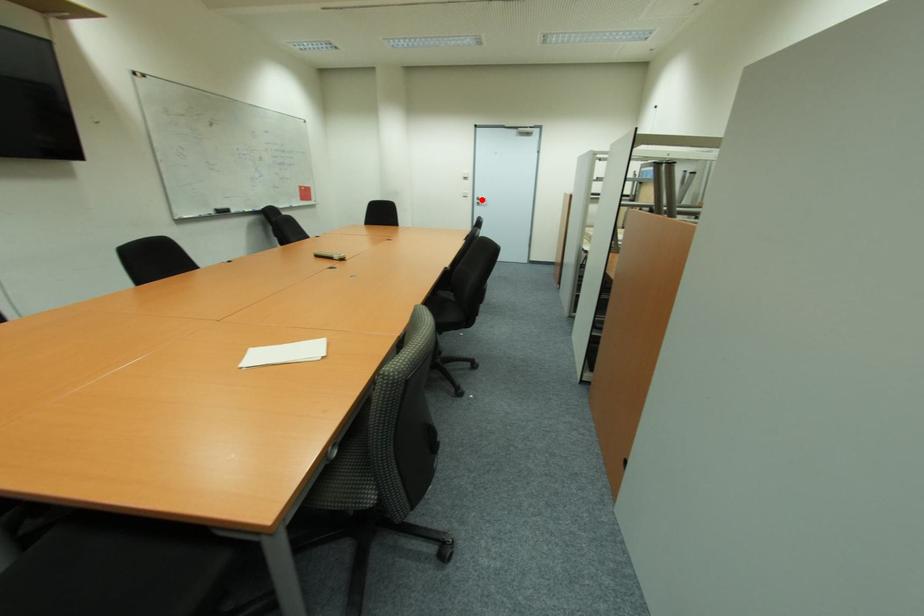
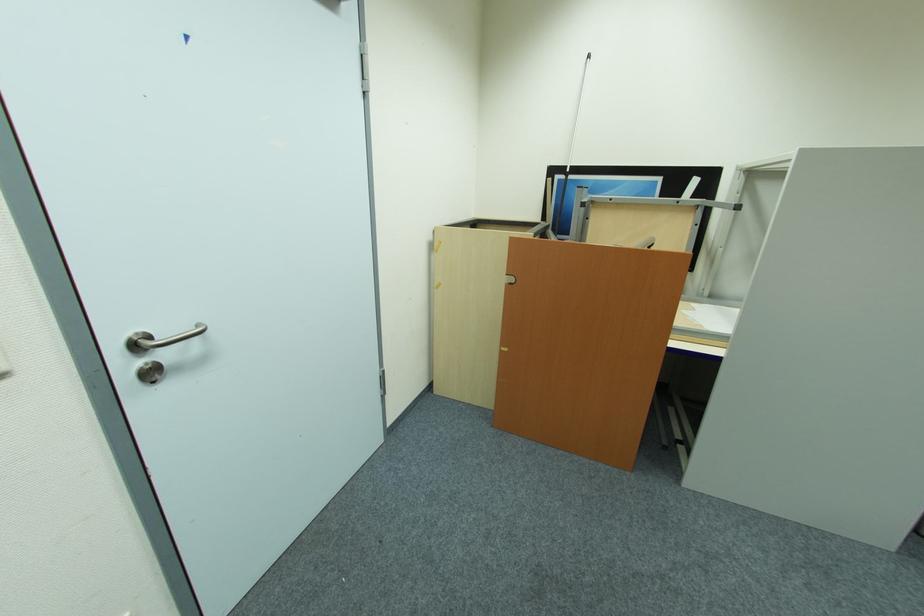
Question: I am providing you with two images of the same scene from different viewpoints. Given a red point in image1, look at the same physical point in image2. Is it:

Choices:
 (A) Closer to the viewpoint
 (B) Farther from the viewpoint

Answer: (B)